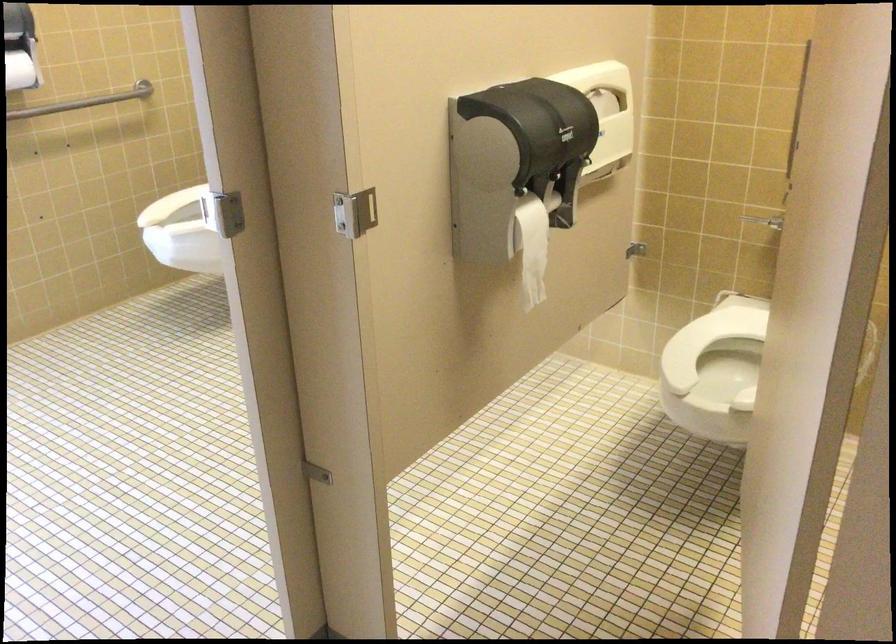
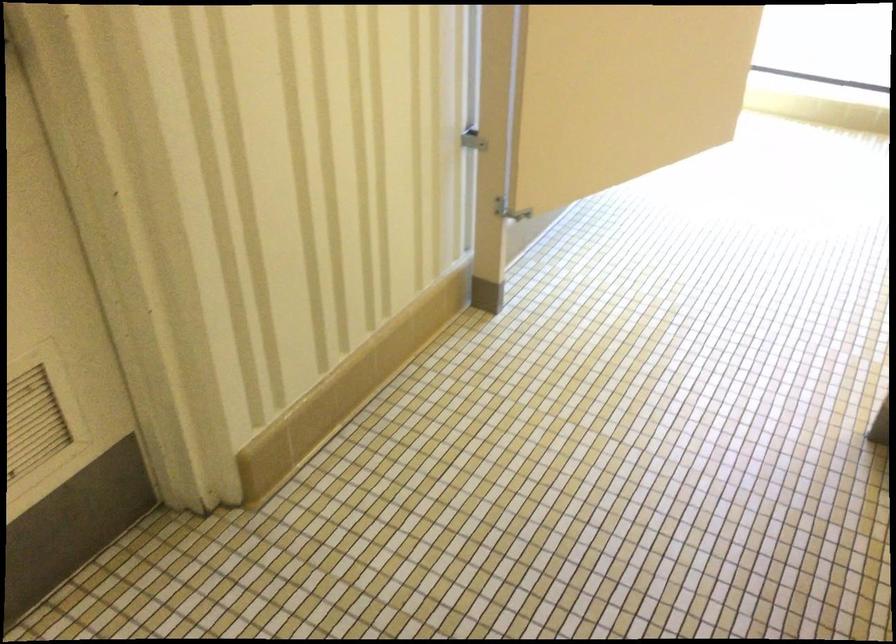
In the scene shown: Based on the continuous images, in which direction is the camera rotating?

The camera rotated toward left-down.